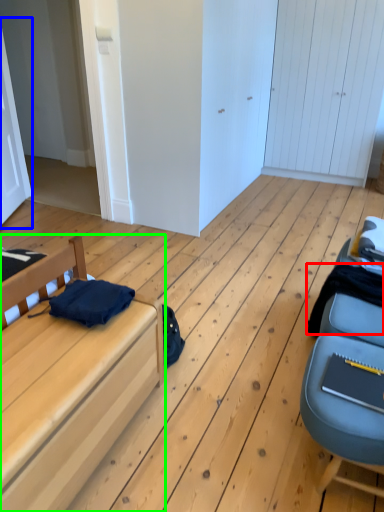
Question: Estimate the real-world distances between objects in this image. Which object is closer to clothing (highlighted by a red box), door (highlighted by a blue box) or furniture (highlighted by a green box)?

Choices:
 (A) door
 (B) furniture

Answer: (B)